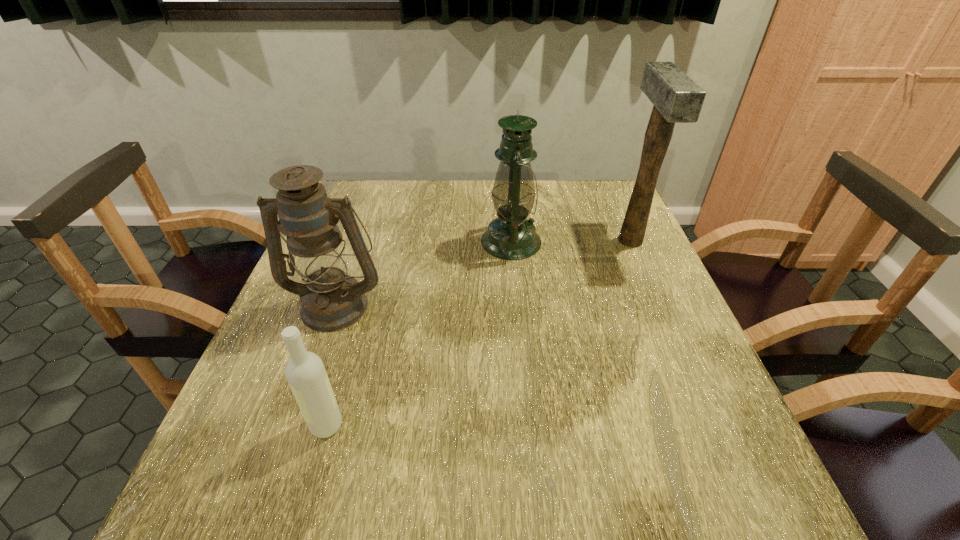
Locate an element on the screen. vacant region at the left edge is located at coordinates (252, 463).

Image resolution: width=960 pixels, height=540 pixels. I want to click on free space at the right edge of the desktop, so click(x=687, y=342).

The image size is (960, 540). Find the location of `free space at the far right corner of the desktop`. free space at the far right corner of the desktop is located at coordinates (597, 197).

In the image, there is a desktop. Where is `vacant space at the near right corner`? The image size is (960, 540). vacant space at the near right corner is located at coordinates (757, 478).

I want to click on unoccupied area between the shortest object and the mallet, so click(478, 333).

Find the location of a particular element. vacant area between the farther oil lamp and the left oil lamp is located at coordinates (423, 273).

Image resolution: width=960 pixels, height=540 pixels. I want to click on vacant region between the mallet and the nearer oil lamp, so point(483,273).

The image size is (960, 540). Identify the location of vacant area that lies between the tallest object and the nearer oil lamp. (483, 273).

Image resolution: width=960 pixels, height=540 pixels. I want to click on free point between the nearer oil lamp and the farther oil lamp, so click(x=423, y=273).

Locate an element on the screen. This screenshot has height=540, width=960. unoccupied position between the rightmost object and the vodka is located at coordinates (478, 333).